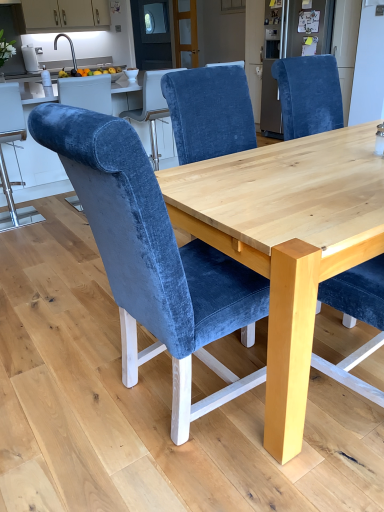
I want to click on free spot in front of velvet blue chair at center, which is the second chair in left-to-right order, so click(195, 477).